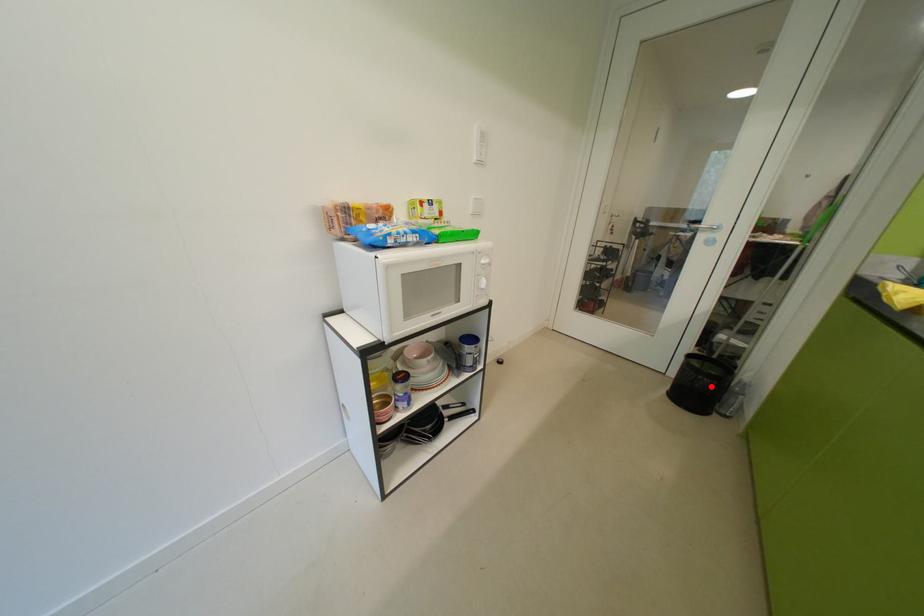
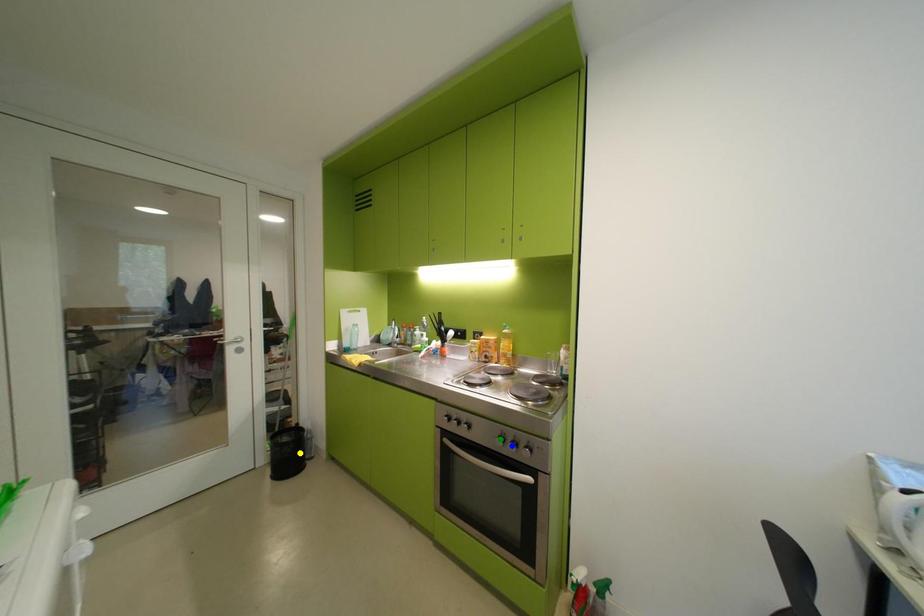
Question: I am providing you with two images of the same scene from different viewpoints. A red point is marked on the first image. You are given multiple points on the second image. Which point in image 2 is actually the same real-world point as the red point in image 1?

Choices:
 (A) green point
 (B) blue point
 (C) yellow point

Answer: (C)